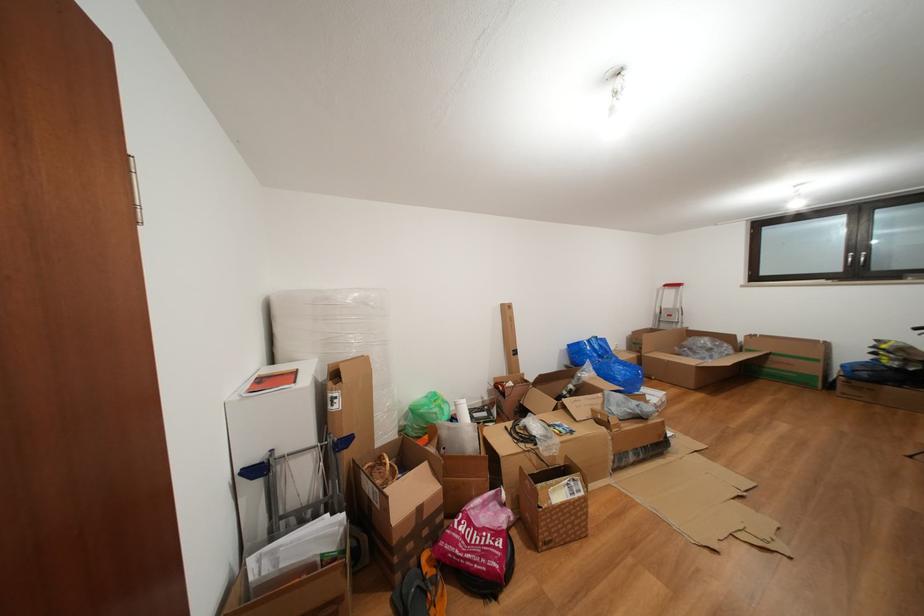
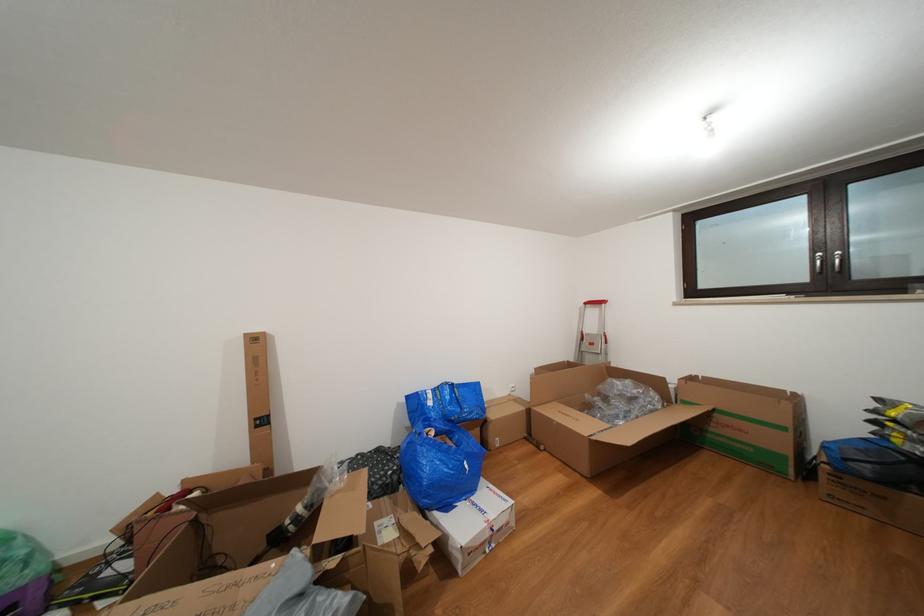
The images are taken continuously from a first-person perspective. In which direction are you moving?

The movement direction of the cameraman is right, forward.